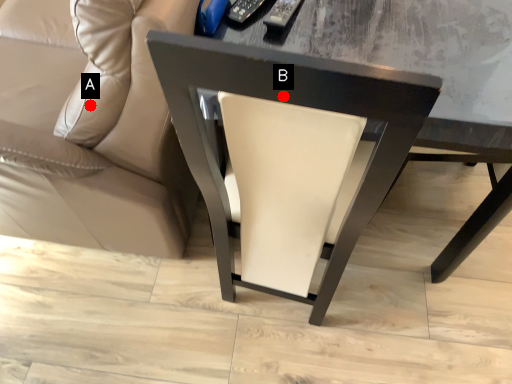
Question: Two points are circled on the image, labeled by A and B beside each circle. Which of the following is the farthest from the observer?

Choices:
 (A) A is further
 (B) B is further

Answer: (A)